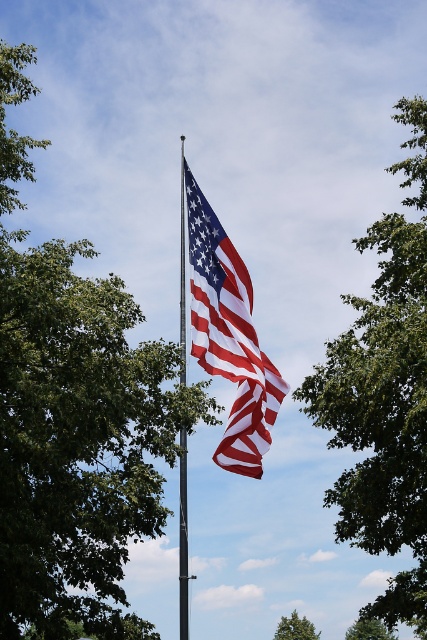
Question: Considering the real-world distances, which object is farthest from the matte fabric flag at center?

Choices:
 (A) green leafy tree at center
 (B) polished metal flag pole at center

Answer: (A)

Question: Is green leafy tree at upper center bigger than polished metal flag pole at center?

Choices:
 (A) no
 (B) yes

Answer: (B)

Question: Can you confirm if green leafy tree at upper left is positioned below polished metal flag pole at center?

Choices:
 (A) yes
 (B) no

Answer: (B)

Question: Among these points, which one is farthest from the camera?

Choices:
 (A) (222, 465)
 (B) (303, 637)

Answer: (B)

Question: Which point is closer to the camera taking this photo?

Choices:
 (A) (389, 225)
 (B) (180, 516)
 (C) (356, 628)
 (D) (87, 369)

Answer: (D)

Question: Does green leafy tree at lower center come in front of green leafy tree at center?

Choices:
 (A) no
 (B) yes

Answer: (A)